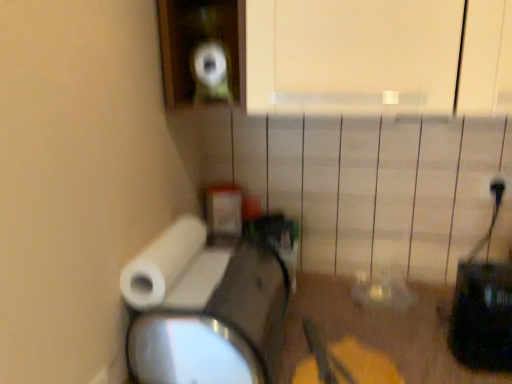
Question: Should I look upward or downward to see white matte toilet paper at lower left?

Choices:
 (A) up
 (B) down

Answer: (B)

Question: Can we say white plastic electric outlet at upper right lies outside white matte toilet paper at lower left?

Choices:
 (A) yes
 (B) no

Answer: (A)

Question: Is white matte toilet paper at lower left completely or partially inside white plastic electric outlet at upper right?

Choices:
 (A) yes
 (B) no

Answer: (B)

Question: Can you confirm if white plastic electric outlet at upper right is smaller than white matte toilet paper at lower left?

Choices:
 (A) no
 (B) yes

Answer: (B)

Question: Is white plastic electric outlet at upper right positioned behind white matte toilet paper at lower left?

Choices:
 (A) yes
 (B) no

Answer: (A)

Question: Is the surface of white plastic electric outlet at upper right in direct contact with white matte toilet paper at lower left?

Choices:
 (A) no
 (B) yes

Answer: (A)

Question: From the image's perspective, does white plastic electric outlet at upper right appear higher than white matte toilet paper at lower left?

Choices:
 (A) yes
 (B) no

Answer: (A)

Question: From the image's perspective, would you say white matte toilet paper at lower left is positioned over white plastic electric outlet at upper right?

Choices:
 (A) no
 (B) yes

Answer: (A)

Question: Is white matte toilet paper at lower left wider than white plastic electric outlet at upper right?

Choices:
 (A) no
 (B) yes

Answer: (B)

Question: Does white matte toilet paper at lower left have a lesser height compared to white plastic electric outlet at upper right?

Choices:
 (A) no
 (B) yes

Answer: (A)

Question: Can you confirm if white matte toilet paper at lower left is positioned to the left of white plastic electric outlet at upper right?

Choices:
 (A) yes
 (B) no

Answer: (A)

Question: Is white matte toilet paper at lower left positioned far away from white plastic electric outlet at upper right?

Choices:
 (A) no
 (B) yes

Answer: (A)

Question: Would you say white plastic electric outlet at upper right is part of white matte toilet paper at lower left's contents?

Choices:
 (A) no
 (B) yes

Answer: (A)

Question: Would you say white plastic electric outlet at upper right is to the left or to the right of white matte toilet paper at lower left in the picture?

Choices:
 (A) left
 (B) right

Answer: (B)